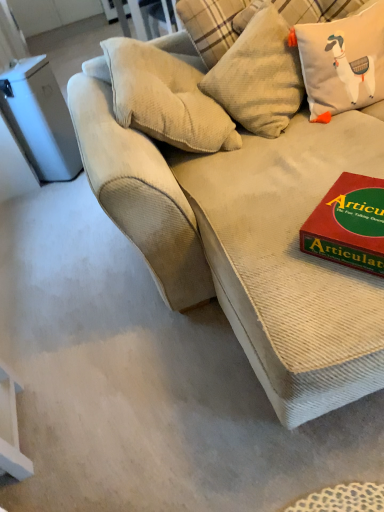
The width and height of the screenshot is (384, 512). What are the coordinates of `empty space that is ontop of red cardboard game at right` in the screenshot? It's located at (355, 208).